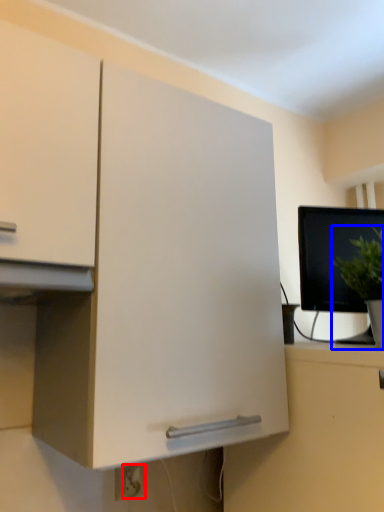
Question: Which object appears farthest to the camera in this image, electric outlet (highlighted by a red box) or houseplant (highlighted by a blue box)?

Choices:
 (A) electric outlet
 (B) houseplant

Answer: (A)